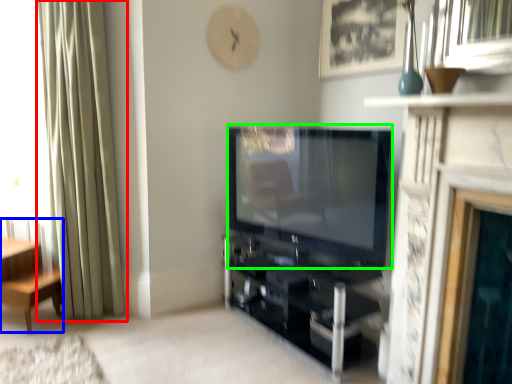
Question: Which is farther away from curtain (highlighted by a red box)? furniture (highlighted by a blue box) or television (highlighted by a green box)?

Choices:
 (A) furniture
 (B) television

Answer: (B)